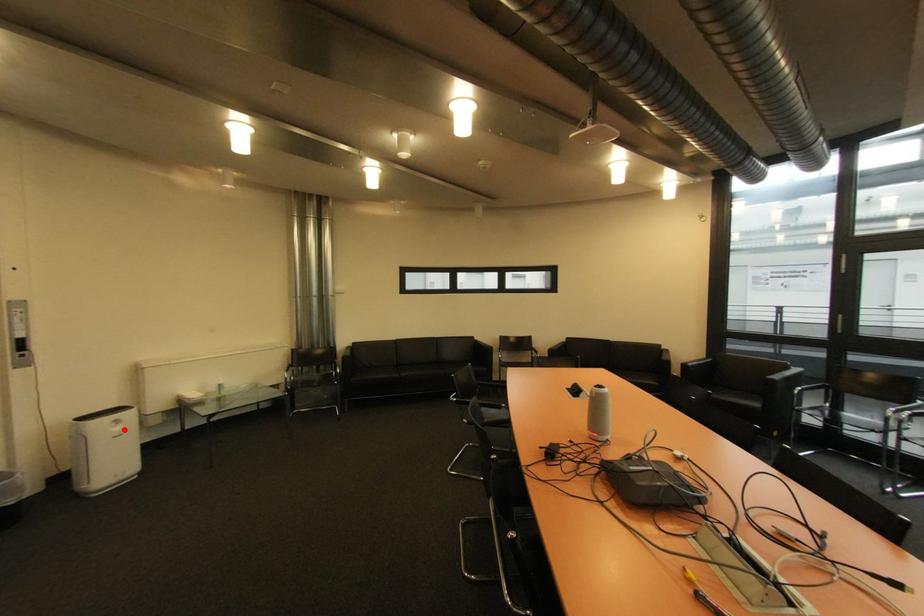
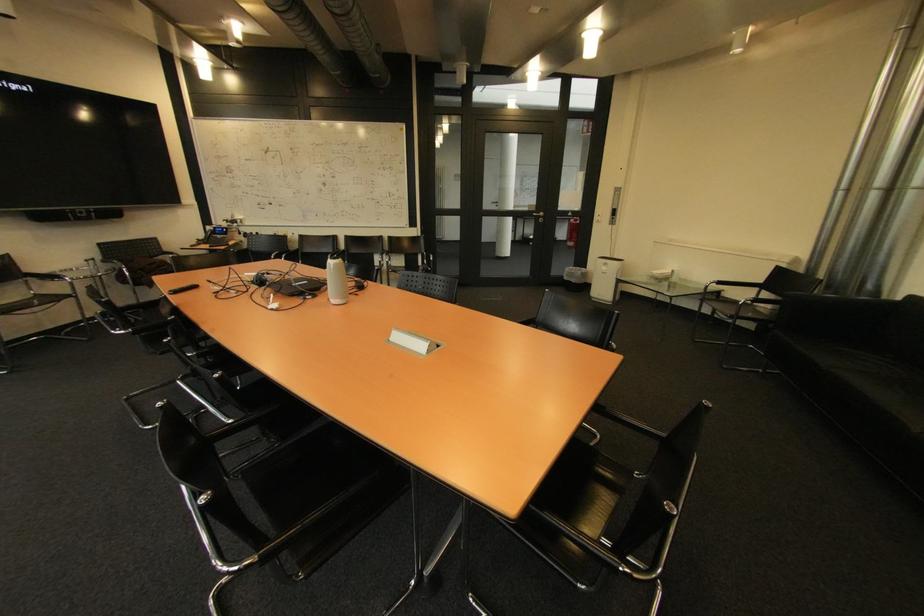
Question: A red point is marked in image1. In image2, is the corresponding 3D point closer to the camera or farther? Reply with the corresponding letter.

Choices:
 (A) The corresponding 3D point is closer.
 (B) The corresponding 3D point is farther.

Answer: (A)